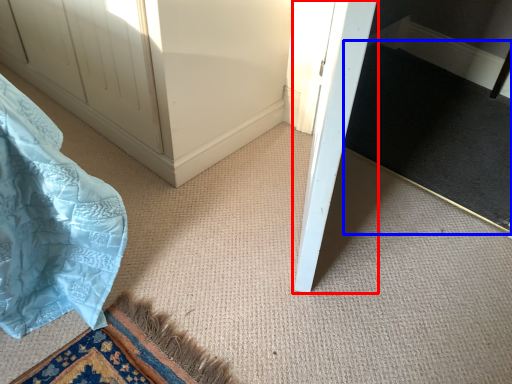
Question: Which object appears closest to the camera in this image, door (highlighted by a red box) or doormat (highlighted by a blue box)?

Choices:
 (A) door
 (B) doormat

Answer: (A)